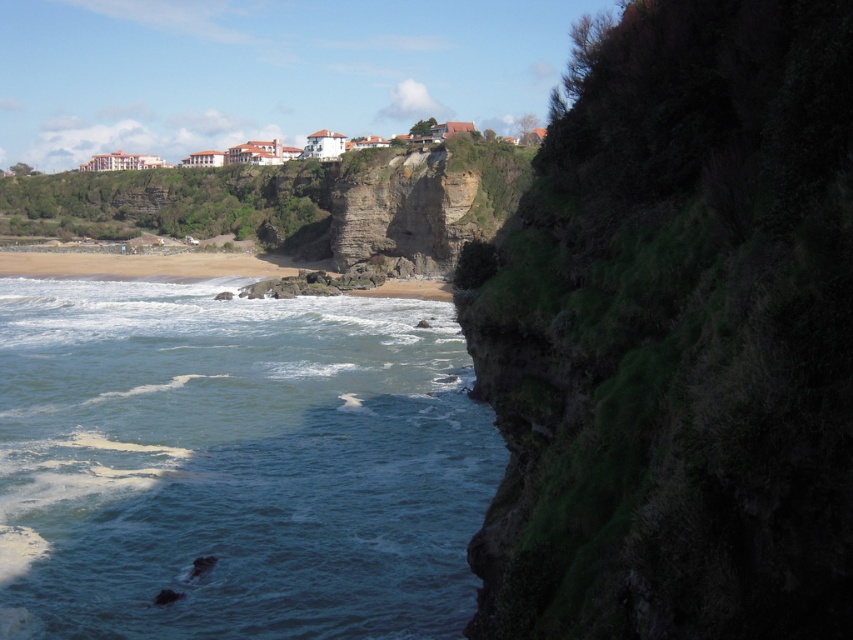
Question: Does green mossy rock at upper center appear on the right side of blue water at lower left?

Choices:
 (A) no
 (B) yes

Answer: (B)

Question: Which point is farther to the camera?

Choices:
 (A) blue water at lower left
 (B) green mossy rock at upper center

Answer: (A)

Question: Is green mossy rock at upper center bigger than blue water at lower left?

Choices:
 (A) yes
 (B) no

Answer: (B)

Question: Which point is farther to the camera?

Choices:
 (A) green mossy rock at upper center
 (B) blue water at lower left

Answer: (B)

Question: Is green mossy rock at upper center wider than blue water at lower left?

Choices:
 (A) yes
 (B) no

Answer: (B)